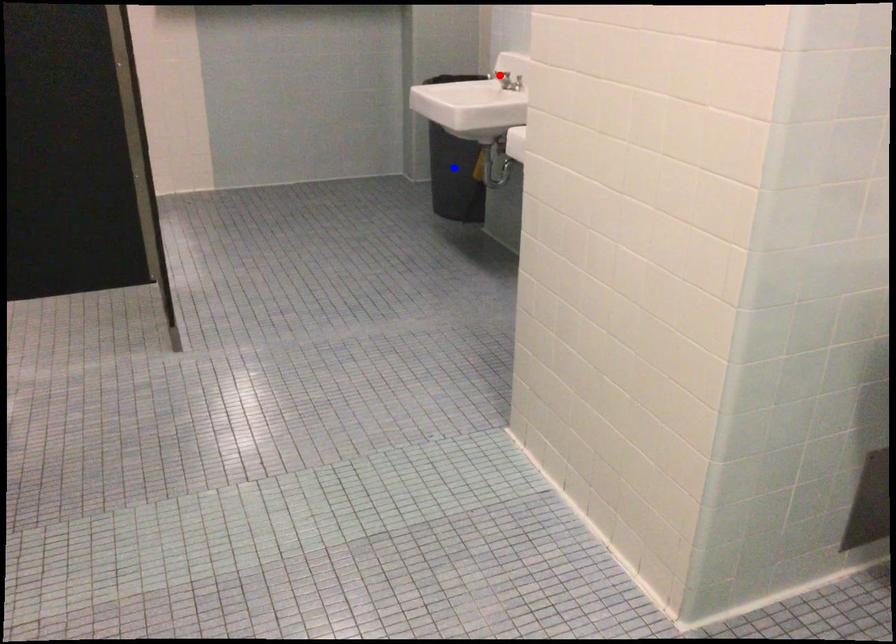
Question: Which of the two points in the image is closer to the camera?

Choices:
 (A) Blue point is closer.
 (B) Red point is closer.

Answer: (B)